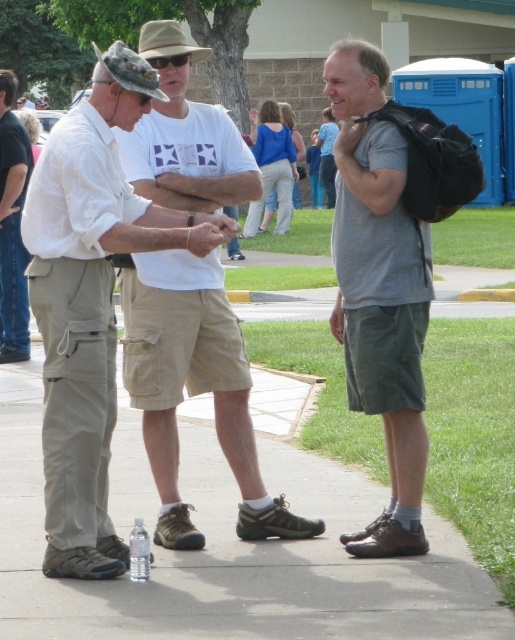
You are standing in the outdoor scene and want to walk from point A to point B. Point A is at coordinate point(216, 189) and point B is at coordinate point(357, 294). Which point is closer to you?

Point A at coordinate point(216, 189) is closer to you since it is further to the viewer than point B at coordinate point(357, 294).

You are a delivery person who needs to place a package on the ground between the khaki cotton shorts at center and the clear plastic bottle at center. Can you fit the package there?

The khaki cotton shorts at center is much taller than the clear plastic bottle at center, so the space between them may not be sufficient for placing a package. Please check the exact distance before deciding.